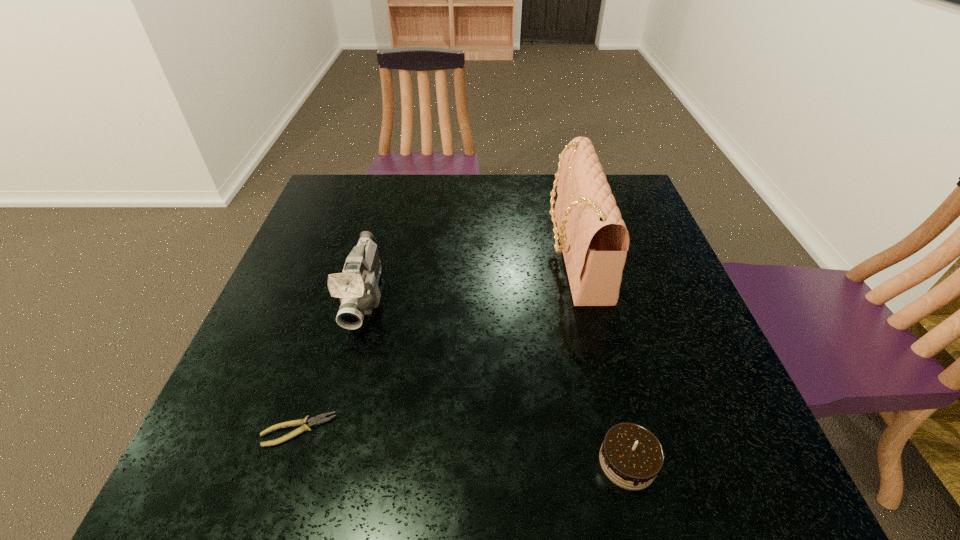
Locate an element on the screen. vacant area that lies between the chocolate cake and the camcorder is located at coordinates (496, 380).

The image size is (960, 540). I want to click on vacant space in between the tallest object and the shortest object, so tap(437, 342).

The width and height of the screenshot is (960, 540). In order to click on empty space that is in between the tallest object and the third tallest object in this screenshot , I will do `click(601, 358)`.

Where is `free spot between the shortest object and the third tallest object`? free spot between the shortest object and the third tallest object is located at coordinates (463, 446).

The width and height of the screenshot is (960, 540). In order to click on free spot between the pliers and the tallest object in this screenshot , I will do `click(437, 342)`.

Identify the location of free space that is in between the second shortest object and the pliers. The height and width of the screenshot is (540, 960). (463, 446).

Locate an element on the screen. The image size is (960, 540). unoccupied position between the camcorder and the tallest object is located at coordinates (470, 275).

Locate an element on the screen. blank region between the pliers and the second tallest object is located at coordinates (332, 363).

At what (x,y) coordinates should I click in order to perform the action: click on vacant space that's between the tallest object and the second tallest object. Please return your answer as a coordinate pair (x, y). Looking at the image, I should click on (470, 275).

Image resolution: width=960 pixels, height=540 pixels. I want to click on empty location between the camcorder and the pliers, so click(x=332, y=363).